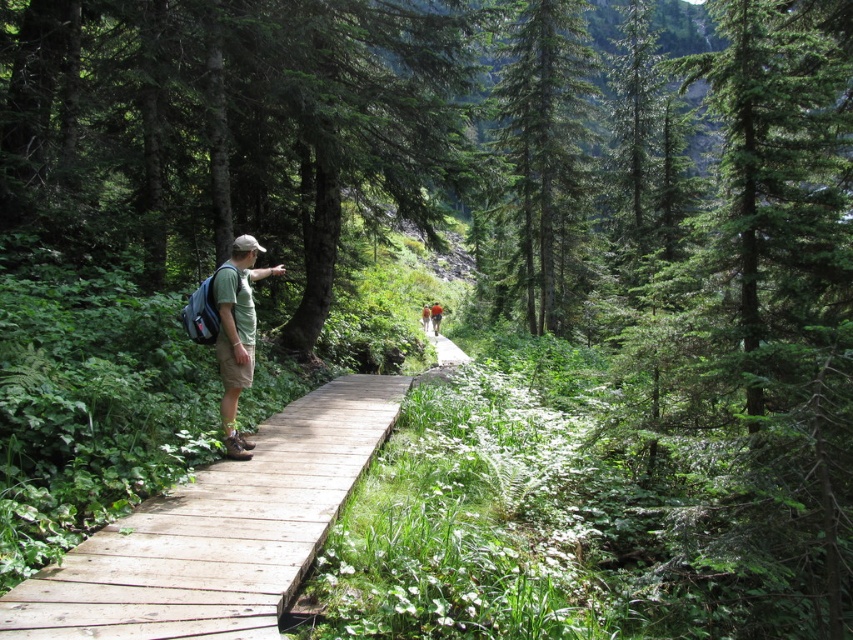
You are a hiker planning to cross the wooden bridge at center and the green grassy trail at center. Which one is narrower? Please answer based on the scene description provided.

The wooden bridge at center is smaller than the green grassy trail at center, so the wooden bridge at center is narrower.

You are standing at the point marked by point (541, 160). Which direction should you walk to reach the wooden boardwalk?

The point (541, 160) is on the green matte tree at center. To reach the wooden boardwalk, you should walk towards the left side of the boardwalk where the man is standing.